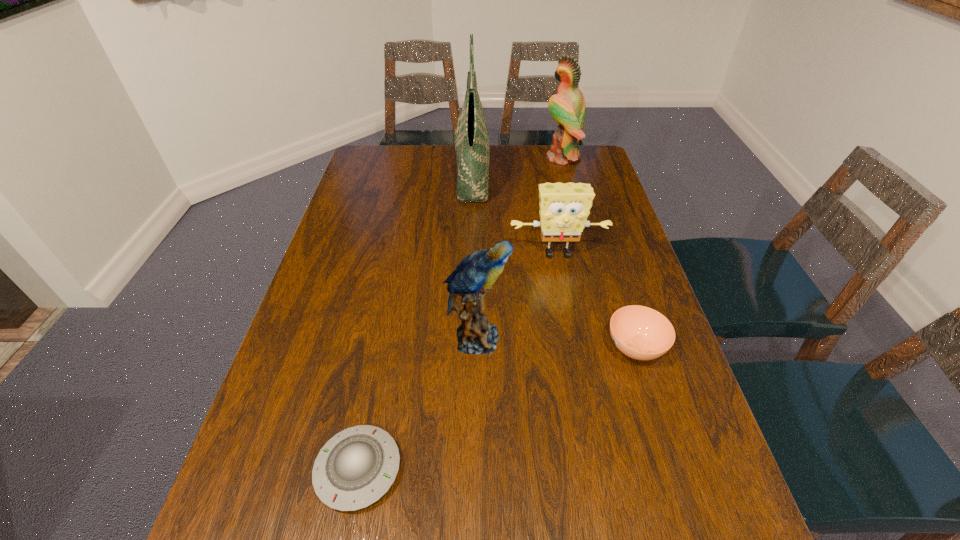
Where is `free region located on the right of the tallest object`? free region located on the right of the tallest object is located at coordinates (571, 175).

Locate an element on the screen. The image size is (960, 540). vacant space located on the front-facing side of the taller parrot is located at coordinates (440, 158).

This screenshot has width=960, height=540. I want to click on free space located 0.220m on the front-facing side of the taller parrot, so click(485, 158).

I want to click on free location located on the front-facing side of the taller parrot, so click(x=444, y=158).

The width and height of the screenshot is (960, 540). What are the coordinates of `free space located on the face of the third tallest object` in the screenshot? It's located at (528, 339).

This screenshot has height=540, width=960. I want to click on vacant space located on the face of the third farthest object, so click(579, 364).

The width and height of the screenshot is (960, 540). In order to click on vacant point located on the left of the soup bowl in this screenshot , I will do `click(579, 347)`.

Identify the location of vacant space located 0.210m on the right of the leftmost object. The height and width of the screenshot is (540, 960). (514, 469).

Find the location of a particular element. tote bag located in the far edge section of the desktop is located at coordinates (471, 138).

The height and width of the screenshot is (540, 960). In order to click on parrot positioned at the far edge in this screenshot , I will do `click(567, 107)`.